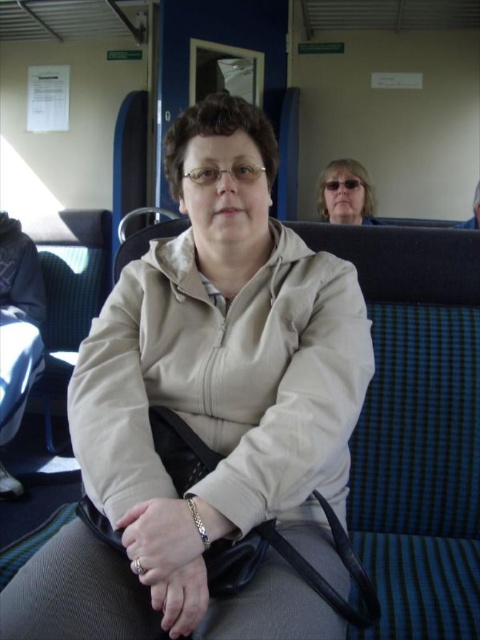
Question: Which of the following is the closest to the observer?

Choices:
 (A) (208, 308)
 (B) (201, 522)

Answer: (B)

Question: Which point appears closest to the camera in this image?

Choices:
 (A) (113, 611)
 (B) (188, 497)
 (C) (356, 218)

Answer: (A)

Question: Does matte black sunglasses at upper center appear on the right side of silver metallic bracelet at lower center?

Choices:
 (A) yes
 (B) no

Answer: (A)

Question: Is matte black sunglasses at upper center above silver metallic bracelet at lower center?

Choices:
 (A) yes
 (B) no

Answer: (A)

Question: Is beige fabric jacket at center behind matte black sunglasses at upper center?

Choices:
 (A) no
 (B) yes

Answer: (A)

Question: Estimate the real-world distances between objects in this image. Which object is farther from the matte black sunglasses at upper center?

Choices:
 (A) silver metallic bracelet at lower center
 (B) beige fabric jacket at center

Answer: (A)